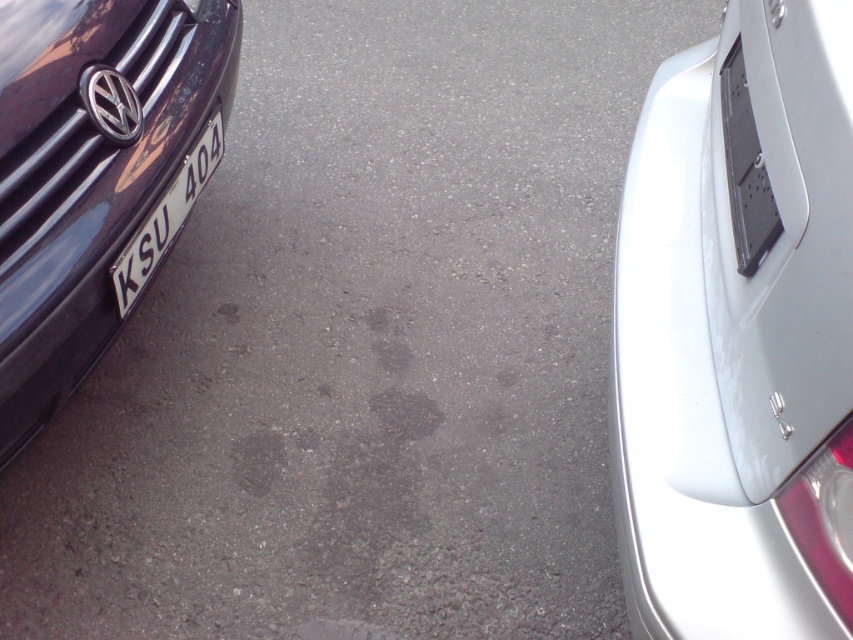
In the scene shown: You are a parking attendant checking vehicle details. You see the satin white bumper at right and the white glossy license plate at left. Which object takes up more space in the image?

The satin white bumper at right is larger in size than the white glossy license plate at left, so it takes up more space in the image.

You are a parking attendant checking vehicle dimensions. The glossy black car at left and the white glossy license plate at left are in your view. Which object is taller?

The glossy black car at left is taller than the white glossy license plate at left.

You are a parking attendant checking license plate positions. The glossy black car at left has a white glossy license plate at left. Which object is further to the left?

The glossy black car at left is positioned on the left side of white glossy license plate at left, so the glossy black car at left is further to the left.